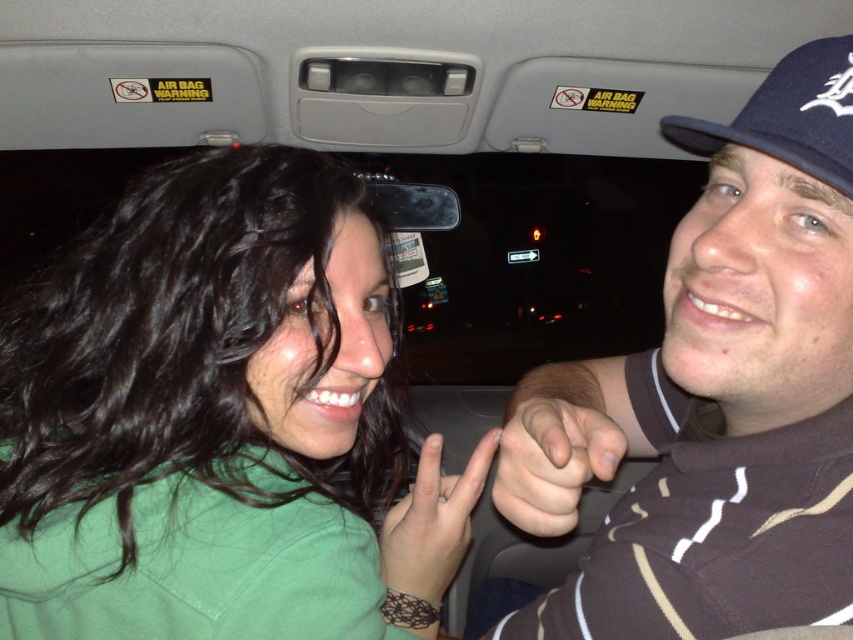
You are a passenger in the car and want to touch the green matte shirt at upper left. Which direction should you move your hand from your current position at point (219, 422)?

The green matte shirt at upper left is located at point (219, 422), so you are already at that position.

You are a photographer taking a picture of the green matte shirt at upper left and the brown striped shirt at right. Which shirt should you adjust to ensure both are centered in the frame?

The green matte shirt at upper left is to the left of brown striped shirt at right, so you should move the green matte shirt at upper left slightly to the right to center both shirts in the frame.

You are a photographer taking a nighttime car portrait. You have a camera focused on the green matte shirt at upper left and the blue fabric baseball cap at upper right. Which object should you adjust your focus to if you want to ensure the taller one is sharp?

The green matte shirt at upper left is taller than the blue fabric baseball cap at upper right, so you should adjust your focus to the green matte shirt at upper left to ensure the taller one is sharp.